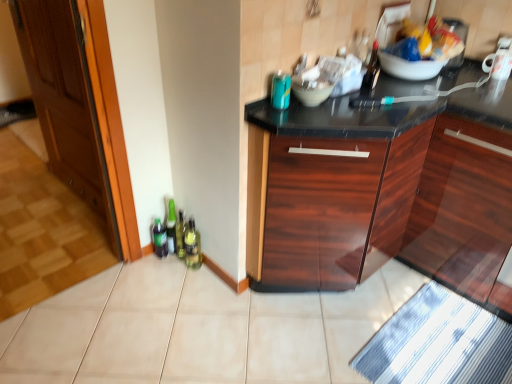
Locate an element on the screen. free space in front of matte white bowl at center is located at coordinates (325, 118).